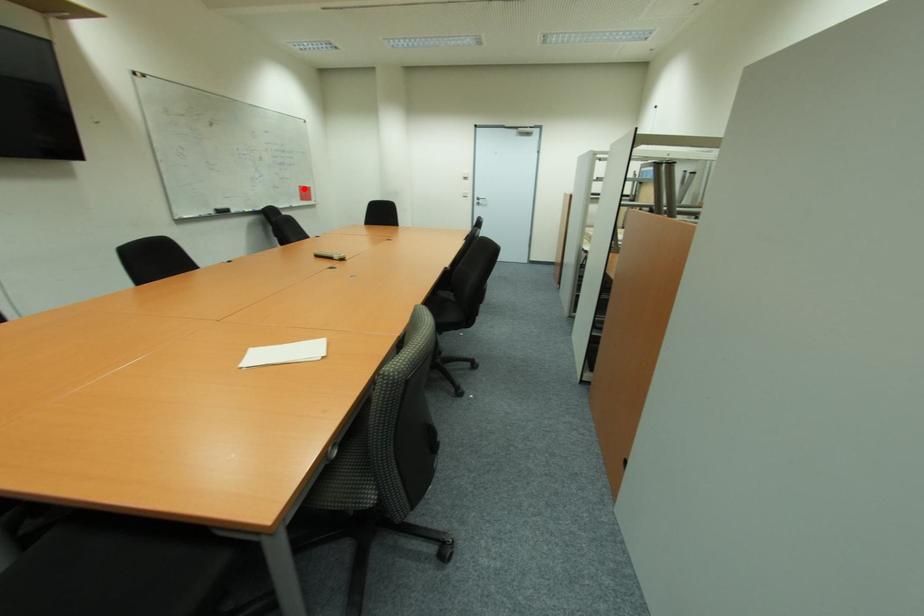
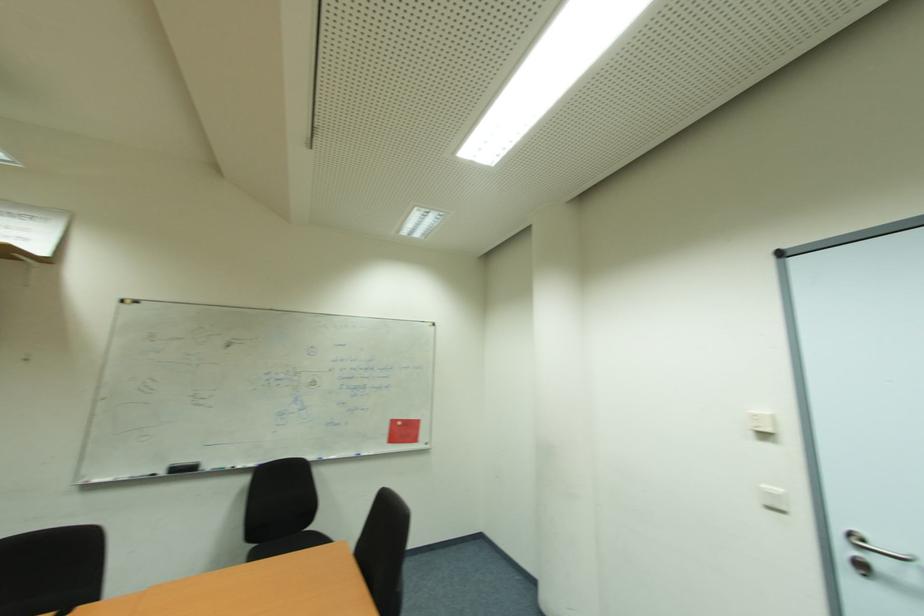
Question: I am providing you with two images of the same scene from different viewpoints. In image1, a red point is highlighted. Considering the same 3D point in image2, which of the following is correct?

Choices:
 (A) It is closer
 (B) It is farther

Answer: (B)